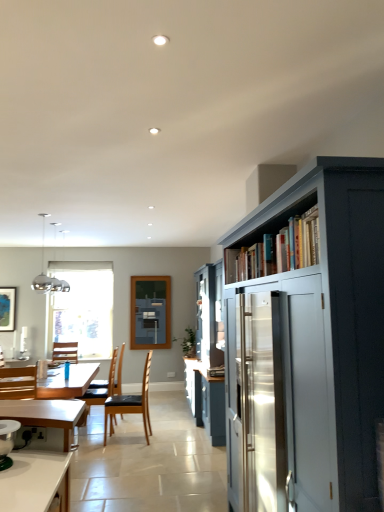
Question: Is white painted wood bookshelf at upper right oriented away from black leather chair at center, positioned as the 1th chair in right-to-left order?

Choices:
 (A) no
 (B) yes

Answer: (A)

Question: Is white painted wood bookshelf at upper right with black leather chair at center, the 2th chair from the front?

Choices:
 (A) no
 (B) yes

Answer: (A)

Question: From the image's perspective, is white painted wood bookshelf at upper right on top of black leather chair at center, positioned as the 1th chair in right-to-left order?

Choices:
 (A) yes
 (B) no

Answer: (A)

Question: Does white painted wood bookshelf at upper right have a lesser width compared to black leather chair at center, positioned as the 1th chair in right-to-left order?

Choices:
 (A) yes
 (B) no

Answer: (A)

Question: Could you tell me if white painted wood bookshelf at upper right is turned towards black leather chair at center, arranged as the 3th chair when viewed from the back?

Choices:
 (A) no
 (B) yes

Answer: (A)

Question: From a real-world perspective, is white painted wood bookshelf at upper right located beneath black leather chair at center, arranged as the 3th chair when viewed from the back?

Choices:
 (A) no
 (B) yes

Answer: (A)

Question: Considering the relative sizes of clear glass window at center and wooden chair at left, arranged as the 4th chair when viewed from the right, in the image provided, is clear glass window at center smaller than wooden chair at left, arranged as the 4th chair when viewed from the right,?

Choices:
 (A) yes
 (B) no

Answer: (B)

Question: Can you confirm if clear glass window at center is taller than wooden chair at left, which appears as the fourth chair when viewed from the front?

Choices:
 (A) no
 (B) yes

Answer: (B)

Question: Considering the relative sizes of clear glass window at center and wooden chair at left, which appears as the fourth chair when viewed from the front, in the image provided, is clear glass window at center shorter than wooden chair at left, which appears as the fourth chair when viewed from the front,?

Choices:
 (A) no
 (B) yes

Answer: (A)

Question: Is clear glass window at center facing towards wooden chair at left, which appears as the fourth chair when viewed from the front?

Choices:
 (A) no
 (B) yes

Answer: (B)

Question: Does clear glass window at center touch wooden chair at left, arranged as the 4th chair when viewed from the right?

Choices:
 (A) yes
 (B) no

Answer: (B)

Question: Does clear glass window at center come in front of wooden chair at left, which appears as the fourth chair when viewed from the front?

Choices:
 (A) yes
 (B) no

Answer: (B)

Question: Is matte gray cupboard at right smaller than blue fabric at center?

Choices:
 (A) no
 (B) yes

Answer: (A)